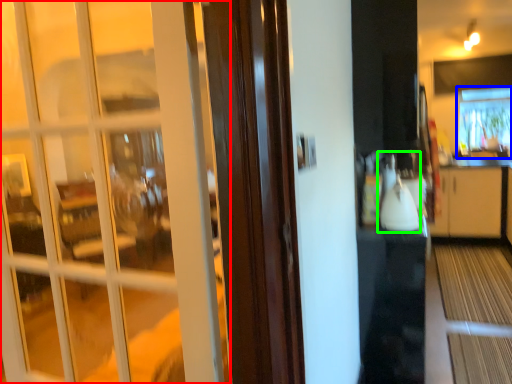
Question: Based on their relative distances, which object is nearer to door (highlighted by a red box)? Choose from window (highlighted by a blue box) and appliance (highlighted by a green box).

Choices:
 (A) window
 (B) appliance

Answer: (B)